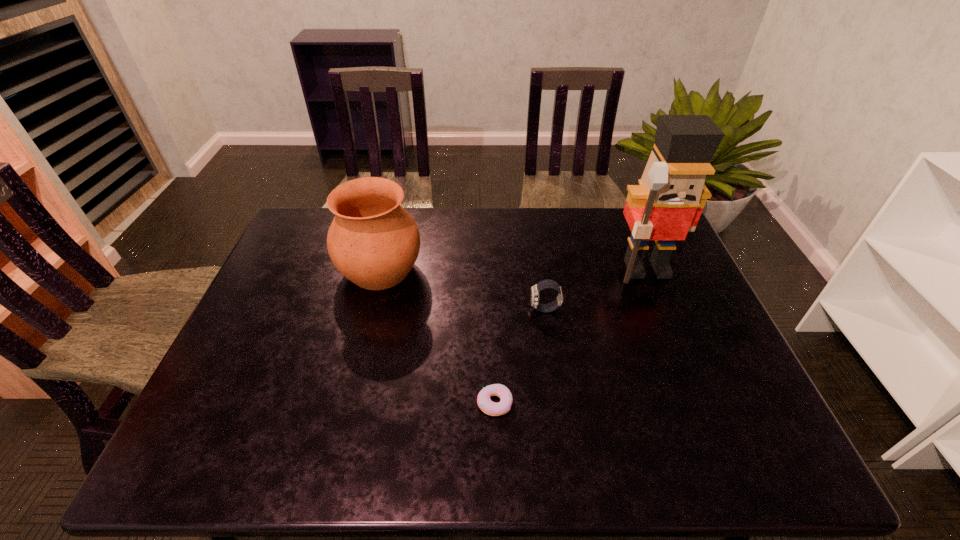
You are a GUI agent. You are given a task and a screenshot of the screen. Output one action in this format:
    pyautogui.click(x=<x>, y=<y>)
    Task: Click on the rightmost object
    This screenshot has height=540, width=960.
    Given the screenshot: What is the action you would take?
    pyautogui.click(x=668, y=202)

Image resolution: width=960 pixels, height=540 pixels. I want to click on the tallest object, so click(668, 202).

Find the location of a particular element. This screenshot has height=540, width=960. pottery is located at coordinates (373, 241).

Find the location of a particular element. Image resolution: width=960 pixels, height=540 pixels. the leftmost object is located at coordinates (373, 241).

Find the location of a particular element. This screenshot has width=960, height=540. the second shortest object is located at coordinates (544, 284).

This screenshot has height=540, width=960. What are the coordinates of `watch` in the screenshot? It's located at (544, 284).

Locate an element on the screen. the nearest object is located at coordinates (491, 408).

Locate an element on the screen. the shortest object is located at coordinates (491, 408).

This screenshot has width=960, height=540. Identify the location of vacant region located in front of the nutcracker holding the staff. (673, 332).

This screenshot has width=960, height=540. I want to click on vacant space located on the left of the pottery, so click(282, 270).